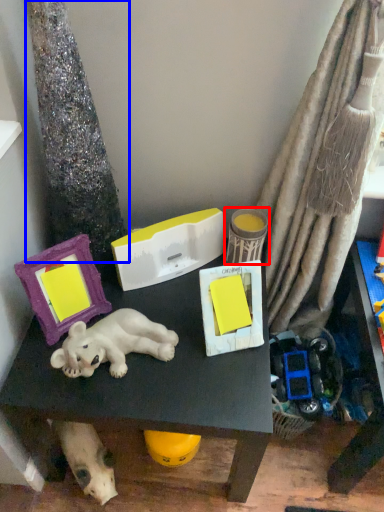
Question: Which point is closer to the camera, toy (highlighted by a red box) or tree trunk (highlighted by a blue box)?

Choices:
 (A) toy
 (B) tree trunk

Answer: (B)